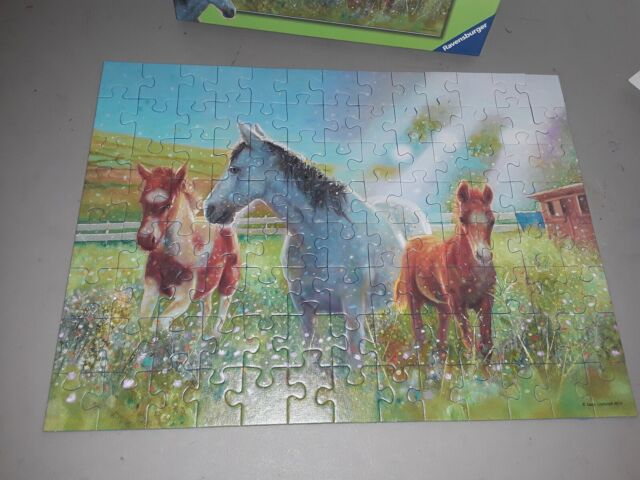
Find the location of `corners`. corners is located at coordinates (44, 430), (105, 62), (557, 78), (636, 416).